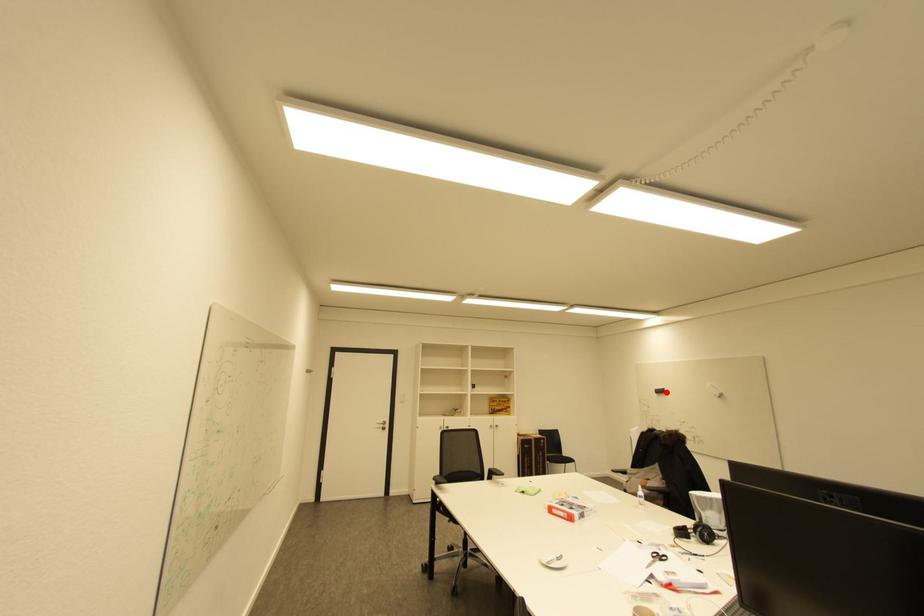
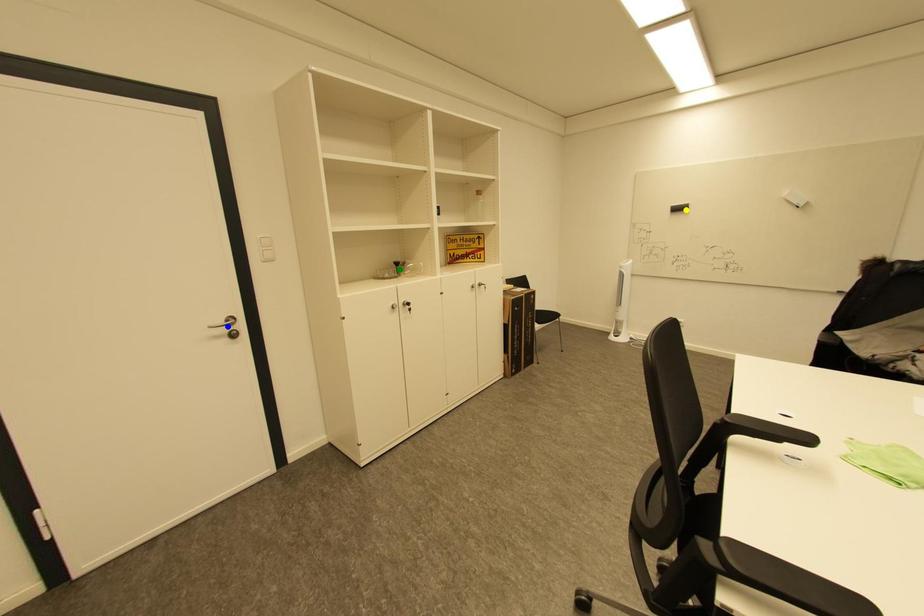
Question: I am providing you with two images of the same scene from different viewpoints. A red point is marked on the first image. You are given multiple points on the second image. Which point in image 2 represents the same 3d spot as the red point in image 1?

Choices:
 (A) yellow point
 (B) blue point
 (C) green point

Answer: (A)